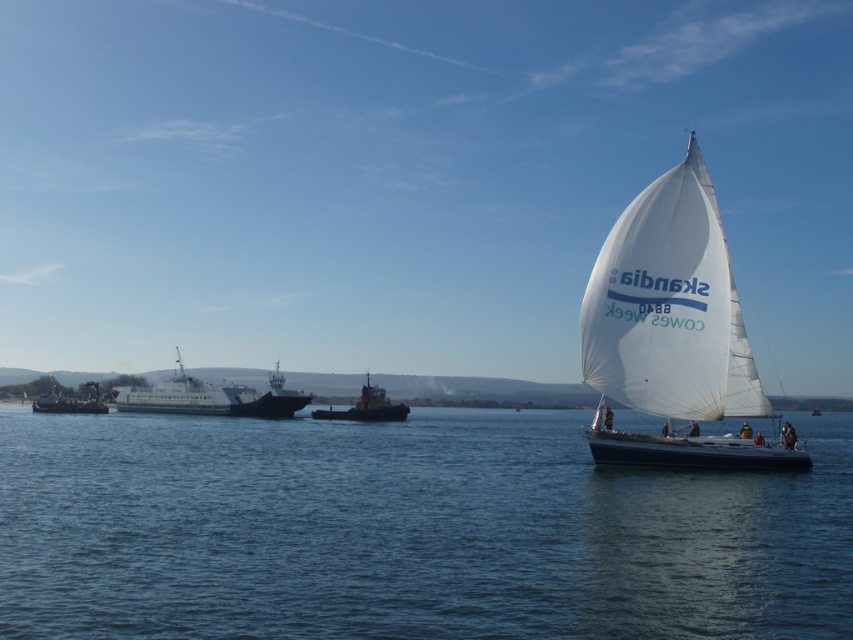
Between blue water at center and orange metallic tugboat at center, which one appears on the left side from the viewer's perspective?

orange metallic tugboat at center

Between point (718, 596) and point (363, 385), which one is positioned in front?

Point (718, 596)

The width and height of the screenshot is (853, 640). What are the coordinates of `blue water at center` in the screenshot? It's located at (405, 531).

Does blue water at center appear on the right side of metallic gray ship at left?

Indeed, blue water at center is positioned on the right side of metallic gray ship at left.

This screenshot has height=640, width=853. Describe the element at coordinates (405, 531) in the screenshot. I see `blue water at center` at that location.

Where is `blue water at center`? blue water at center is located at coordinates (405, 531).

Is blue water at center bigger than dark gray metallic ferry at left?

Yes.

Is blue water at center smaller than dark gray metallic ferry at left?

Incorrect, blue water at center is not smaller in size than dark gray metallic ferry at left.

What do you see at coordinates (405, 531) in the screenshot? This screenshot has width=853, height=640. I see `blue water at center` at bounding box center [405, 531].

The height and width of the screenshot is (640, 853). Find the location of `blue water at center`. blue water at center is located at coordinates (405, 531).